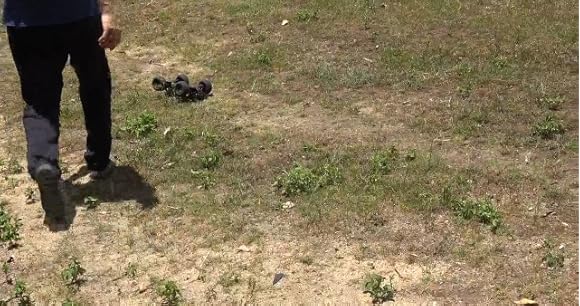
Locate an element on the screen. Image resolution: width=580 pixels, height=306 pixels. toy car is located at coordinates (187, 86).